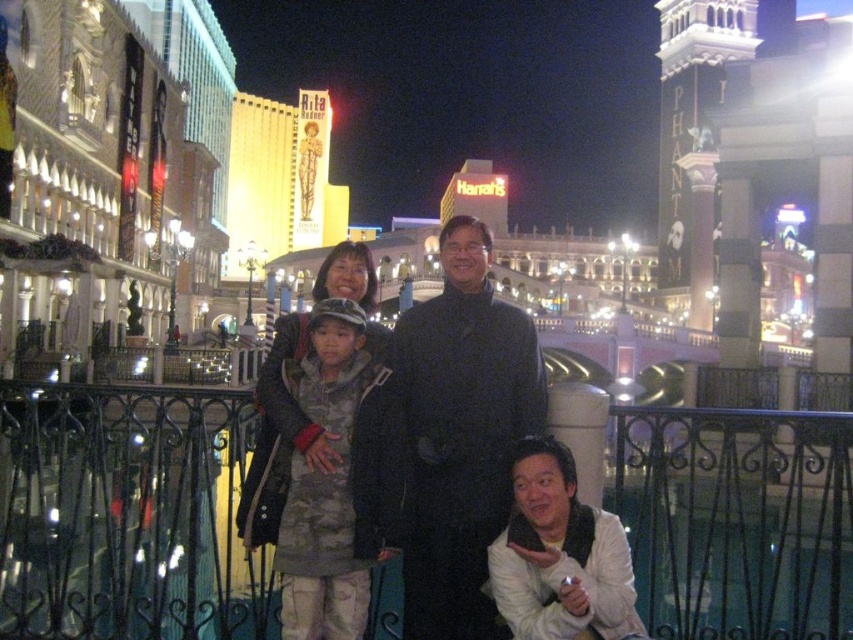
Consider the image. Can you confirm if camouflage jacket at center is shorter than black matte suit at center?

Yes.

Is camouflage jacket at center bigger than black matte suit at center?

Yes, camouflage jacket at center is bigger than black matte suit at center.

Where is `camouflage jacket at center`? camouflage jacket at center is located at coordinates (457, 435).

You are a GUI agent. You are given a task and a screenshot of the screen. Output one action in this format:
    pyautogui.click(x=<x>, y=<y>)
    Task: Click on the camouflage jacket at center
    Image resolution: width=853 pixels, height=640 pixels.
    Given the screenshot: What is the action you would take?
    pyautogui.click(x=457, y=435)

Consider the image. Is black matte suit at center bigger than camouflage fabric jacket at center?

Yes, black matte suit at center is bigger than camouflage fabric jacket at center.

Consider the image. Measure the distance between black matte suit at center and camera.

black matte suit at center is 41.10 meters from camera.

Measure the distance between black matte suit at center and camera.

black matte suit at center and camera are 41.10 meters apart from each other.

Image resolution: width=853 pixels, height=640 pixels. In order to click on black matte suit at center in this screenshot , I will do `click(461, 433)`.

Can you confirm if camouflage jacket at center is positioned to the left of camouflage fabric jacket at center?

In fact, camouflage jacket at center is to the right of camouflage fabric jacket at center.

Measure the distance between camouflage jacket at center and camouflage fabric jacket at center.

camouflage jacket at center and camouflage fabric jacket at center are 8.90 feet apart.

This screenshot has width=853, height=640. Identify the location of camouflage jacket at center. (457, 435).